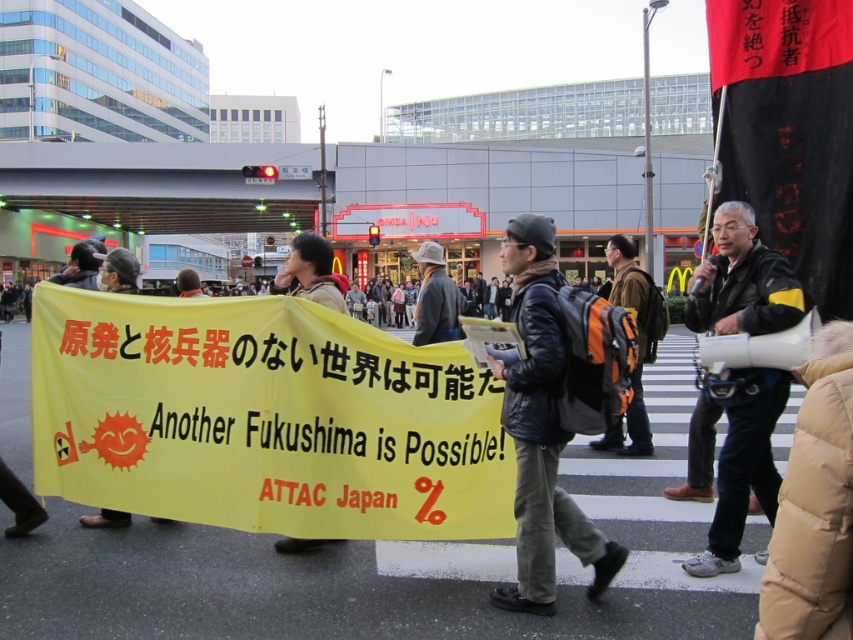
Between point (543, 468) and point (322, 236), which one is positioned behind?

The point (322, 236) is more distant.

What do you see at coordinates (544, 422) in the screenshot? Image resolution: width=853 pixels, height=640 pixels. I see `dark blue leather jacket at center` at bounding box center [544, 422].

Where is `dark blue leather jacket at center`? Image resolution: width=853 pixels, height=640 pixels. dark blue leather jacket at center is located at coordinates (544, 422).

Is point (544, 454) positioned after point (646, 282)?

No, it is in front of (646, 282).

Does dark blue leather jacket at center appear on the left side of orange fabric backpack at center?

Indeed, dark blue leather jacket at center is positioned on the left side of orange fabric backpack at center.

Between point (546, 230) and point (633, 273), which one is positioned in front?

Positioned in front is point (546, 230).

Locate an element on the screen. The image size is (853, 640). dark blue leather jacket at center is located at coordinates (544, 422).

Does point (619, 288) come farther from viewer compared to point (273, 292)?

No, it is in front of (273, 292).

Who is more forward, (607, 449) or (306, 248)?

Point (306, 248)

Image resolution: width=853 pixels, height=640 pixels. Identify the location of orange fabric backpack at center. (637, 342).